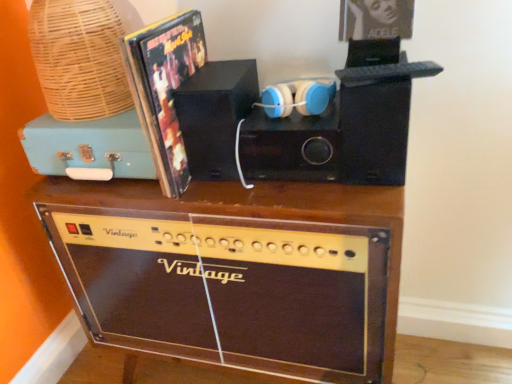
Looking at this image, what is the approximate width of woven bamboo basket at upper left?

The width of woven bamboo basket at upper left is 11.46 inches.

What is the approximate height of brown wood amplifier at lower center?

It is 28.32 inches.

Measure the distance between teal matte suitcase at upper left and camera.

They are 85.10 centimeters apart.

Where is `black matte speaker at center, the first speaker when ordered from right to left`? Image resolution: width=512 pixels, height=384 pixels. black matte speaker at center, the first speaker when ordered from right to left is located at coordinates (289, 146).

Describe the element at coordinates (289, 146) in the screenshot. I see `black matte speaker at center, the first speaker when ordered from right to left` at that location.

The image size is (512, 384). Find the location of `blue matte headphones at center`. blue matte headphones at center is located at coordinates (297, 97).

Locate an element on the screen. The width and height of the screenshot is (512, 384). woven bamboo basket at upper left is located at coordinates pos(81,56).

From the image's perspective, which one is positioned higher, black matte speaker at center, the first speaker when ordered from right to left, or teal matte suitcase at upper left?

teal matte suitcase at upper left appears higher in the image.

Is black matte speaker at center, the first speaker when ordered from right to left, not within teal matte suitcase at upper left?

Yes, black matte speaker at center, the first speaker when ordered from right to left, is located beyond the bounds of teal matte suitcase at upper left.

Is black matte speaker at center, the 2th speaker positioned from the left, at the left side of teal matte suitcase at upper left?

Incorrect, black matte speaker at center, the 2th speaker positioned from the left, is not on the left side of teal matte suitcase at upper left.

Is black matte speaker at center, the 2th speaker positioned from the left, positioned behind teal matte suitcase at upper left?

No, it is in front of teal matte suitcase at upper left.

Considering the relative sizes of black matte speaker at center, the 2th speaker positioned from the left, and black matte speaker at center, which is the first speaker in left-to-right order, in the image provided, is black matte speaker at center, the 2th speaker positioned from the left, taller than black matte speaker at center, which is the first speaker in left-to-right order,?

Incorrect, the height of black matte speaker at center, the 2th speaker positioned from the left, is not larger of that of black matte speaker at center, which is the first speaker in left-to-right order.

From the image's perspective, is black matte speaker at center, the first speaker when ordered from right to left, located above or below black matte speaker at center, which is the first speaker in left-to-right order?

black matte speaker at center, the first speaker when ordered from right to left, is situated lower than black matte speaker at center, which is the first speaker in left-to-right order, in the image.

From the picture: Can you confirm if black matte speaker at center, the first speaker when ordered from right to left, is smaller than black matte speaker at center, the 2th speaker viewed from the right?

Indeed, black matte speaker at center, the first speaker when ordered from right to left, has a smaller size compared to black matte speaker at center, the 2th speaker viewed from the right.

From the image's perspective, which object appears higher, black matte speaker at center, the first speaker when ordered from right to left, or shiny plastic album cover at upper left?

From the image's view, shiny plastic album cover at upper left is above.

What's the angular difference between black matte speaker at center, the 2th speaker positioned from the left, and shiny plastic album cover at upper left's facing directions?

The facing directions of black matte speaker at center, the 2th speaker positioned from the left, and shiny plastic album cover at upper left are 1.49 degrees apart.

What are the coordinates of `album cover above the black matte speaker at center, the 2th speaker positioned from the left (from the image's perspective)` in the screenshot? It's located at (164, 89).

Is black matte speaker at center, the first speaker when ordered from right to left, next to shiny plastic album cover at upper left?

black matte speaker at center, the first speaker when ordered from right to left, and shiny plastic album cover at upper left are not in contact.

Is brown wood amplifier at lower center wider than woven bamboo basket at upper left?

Correct, the width of brown wood amplifier at lower center exceeds that of woven bamboo basket at upper left.

Is brown wood amplifier at lower center not close to woven bamboo basket at upper left?

They are positioned close to each other.

Based on the photo, is brown wood amplifier at lower center inside the boundaries of woven bamboo basket at upper left, or outside?

brown wood amplifier at lower center is not enclosed by woven bamboo basket at upper left.

From a real-world perspective, is brown wood amplifier at lower center under woven bamboo basket at upper left?

Yes, from a real-world perspective, brown wood amplifier at lower center is under woven bamboo basket at upper left.

Considering the relative sizes of shiny plastic album cover at upper left and woven bamboo basket at upper left in the image provided, is shiny plastic album cover at upper left taller than woven bamboo basket at upper left?

Indeed, shiny plastic album cover at upper left has a greater height compared to woven bamboo basket at upper left.

Can we say shiny plastic album cover at upper left lies outside woven bamboo basket at upper left?

Yes, shiny plastic album cover at upper left is outside of woven bamboo basket at upper left.

Are shiny plastic album cover at upper left and woven bamboo basket at upper left far apart?

No, shiny plastic album cover at upper left is not far from woven bamboo basket at upper left.

How different are the orientations of shiny plastic album cover at upper left and woven bamboo basket at upper left in degrees?

The angular difference between shiny plastic album cover at upper left and woven bamboo basket at upper left is 1.59 degrees.

Consider the image. From the image's perspective, is woven bamboo basket at upper left located beneath teal matte suitcase at upper left?

No, from the image's perspective, woven bamboo basket at upper left is not below teal matte suitcase at upper left.

Locate an element on the screen. This screenshot has width=512, height=384. basket that is in front of the teal matte suitcase at upper left is located at coordinates (81, 56).

Considering the points (92, 109) and (74, 164), which point is behind, point (92, 109) or point (74, 164)?

The point (74, 164) is farther from the camera.

Between woven bamboo basket at upper left and teal matte suitcase at upper left, which one is positioned behind?

teal matte suitcase at upper left is further from the camera.

Who is smaller, blue matte headphones at center or brown wood amplifier at lower center?

With smaller size is blue matte headphones at center.

Is blue matte headphones at center beside brown wood amplifier at lower center?

blue matte headphones at center and brown wood amplifier at lower center are not in contact.

From the picture: How different are the orientations of blue matte headphones at center and brown wood amplifier at lower center in degrees?

There is a 2.53-degree angle between the facing directions of blue matte headphones at center and brown wood amplifier at lower center.

Is blue matte headphones at center located outside brown wood amplifier at lower center?

Yes.

I want to click on speaker below the teal matte suitcase at upper left (from a real-world perspective), so click(289, 146).

What are the coordinates of `speaker that appears on the left of black matte speaker at center, the 2th speaker positioned from the left` in the screenshot? It's located at (215, 115).

When comparing their distances from black matte speaker at center, which is the first speaker in left-to-right order, does blue matte headphones at center or shiny plastic album cover at upper left seem further?

blue matte headphones at center is further to black matte speaker at center, which is the first speaker in left-to-right order.

Considering their positions, is black matte speaker at center, which is the first speaker in left-to-right order, positioned further to brown wood amplifier at lower center than teal matte suitcase at upper left?

Based on the image, black matte speaker at center, which is the first speaker in left-to-right order, appears to be further to brown wood amplifier at lower center.

Based on their spatial positions, is black matte speaker at center, the 2th speaker positioned from the left, or woven bamboo basket at upper left closer to brown wood amplifier at lower center?

black matte speaker at center, the 2th speaker positioned from the left, is positioned closer to the anchor brown wood amplifier at lower center.

Based on their spatial positions, is shiny plastic album cover at upper left or woven bamboo basket at upper left further from blue matte headphones at center?

woven bamboo basket at upper left is positioned further to the anchor blue matte headphones at center.

Considering their positions, is brown wood amplifier at lower center positioned closer to woven bamboo basket at upper left than black matte speaker at center, the 2th speaker viewed from the right?

black matte speaker at center, the 2th speaker viewed from the right, is positioned closer to the anchor woven bamboo basket at upper left.

Estimate the real-world distances between objects in this image. Which object is further from woven bamboo basket at upper left, blue matte headphones at center or black matte speaker at center, the 2th speaker positioned from the left?

blue matte headphones at center.

Which object lies further to the anchor point brown wood amplifier at lower center, shiny plastic album cover at upper left or teal matte suitcase at upper left?

shiny plastic album cover at upper left.

When comparing their distances from black matte speaker at center, which is the first speaker in left-to-right order, does teal matte suitcase at upper left or brown wood amplifier at lower center seem closer?

teal matte suitcase at upper left lies closer to black matte speaker at center, which is the first speaker in left-to-right order, than the other object.

This screenshot has height=384, width=512. I want to click on cassette that lies between woven bamboo basket at upper left and brown wood amplifier at lower center from top to bottom, so click(x=88, y=148).

The width and height of the screenshot is (512, 384). I want to click on cassette between shiny plastic album cover at upper left and brown wood amplifier at lower center in the vertical direction, so click(88, 148).

Where is `cassette between blue matte headphones at center and brown wood amplifier at lower center from top to bottom`? The height and width of the screenshot is (384, 512). cassette between blue matte headphones at center and brown wood amplifier at lower center from top to bottom is located at coordinates (88, 148).

The image size is (512, 384). In order to click on album cover located between teal matte suitcase at upper left and black matte speaker at center, the 2th speaker positioned from the left, in the left-right direction in this screenshot , I will do `click(164, 89)`.